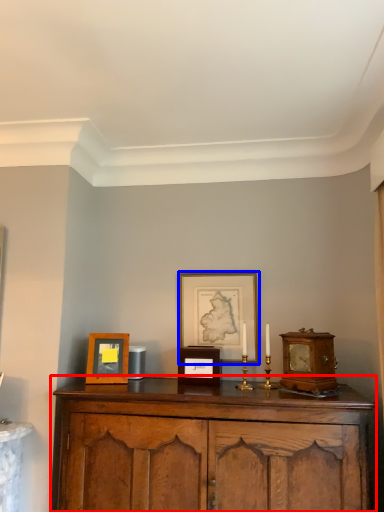
Question: Which object is further to the camera taking this photo, cabinetry (highlighted by a red box) or picture frame (highlighted by a blue box)?

Choices:
 (A) cabinetry
 (B) picture frame

Answer: (B)